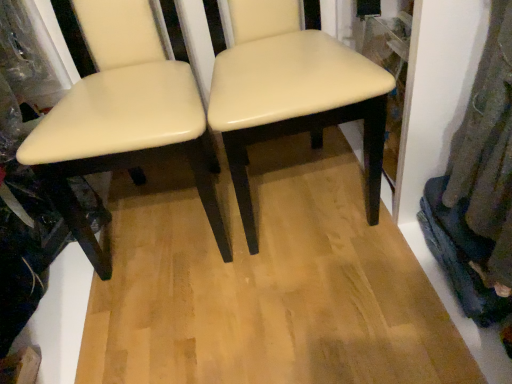
Question: From the image's perspective, is cream matte chair at center, the 1th chair when ordered from right to left, below matte cream chair at center, the 1th chair in the left-to-right sequence?

Choices:
 (A) no
 (B) yes

Answer: (A)

Question: From a real-world perspective, is cream matte chair at center, the 1th chair when ordered from right to left, over matte cream chair at center, placed as the 2th chair when sorted from right to left?

Choices:
 (A) yes
 (B) no

Answer: (B)

Question: Is matte cream chair at center, placed as the 2th chair when sorted from right to left, completely or partially inside cream matte chair at center, the 1th chair when ordered from right to left?

Choices:
 (A) yes
 (B) no

Answer: (B)

Question: Does cream matte chair at center, the second chair when ordered from left to right, have a greater width compared to matte cream chair at center, the 1th chair in the left-to-right sequence?

Choices:
 (A) no
 (B) yes

Answer: (B)

Question: Is cream matte chair at center, the second chair when ordered from left to right, to the left of matte cream chair at center, placed as the 2th chair when sorted from right to left, from the viewer's perspective?

Choices:
 (A) no
 (B) yes

Answer: (A)

Question: Considering the relative positions of cream matte chair at center, the second chair when ordered from left to right, and matte cream chair at center, the 1th chair in the left-to-right sequence, in the image provided, is cream matte chair at center, the second chair when ordered from left to right, in front of matte cream chair at center, the 1th chair in the left-to-right sequence,?

Choices:
 (A) no
 (B) yes

Answer: (A)

Question: Considering the relative sizes of matte cream chair at center, placed as the 2th chair when sorted from right to left, and cream matte chair at center, the 1th chair when ordered from right to left, in the image provided, is matte cream chair at center, placed as the 2th chair when sorted from right to left, wider than cream matte chair at center, the 1th chair when ordered from right to left,?

Choices:
 (A) no
 (B) yes

Answer: (A)

Question: Considering the relative sizes of matte cream chair at center, placed as the 2th chair when sorted from right to left, and cream matte chair at center, the 1th chair when ordered from right to left, in the image provided, is matte cream chair at center, placed as the 2th chair when sorted from right to left, taller than cream matte chair at center, the 1th chair when ordered from right to left,?

Choices:
 (A) yes
 (B) no

Answer: (A)

Question: Is matte cream chair at center, the 1th chair in the left-to-right sequence, oriented away from cream matte chair at center, the second chair when ordered from left to right?

Choices:
 (A) yes
 (B) no

Answer: (B)

Question: Is the position of matte cream chair at center, placed as the 2th chair when sorted from right to left, less distant than that of cream matte chair at center, the second chair when ordered from left to right?

Choices:
 (A) no
 (B) yes

Answer: (B)

Question: Is matte cream chair at center, placed as the 2th chair when sorted from right to left, outside cream matte chair at center, the second chair when ordered from left to right?

Choices:
 (A) no
 (B) yes

Answer: (B)

Question: Considering the relative sizes of matte cream chair at center, the 1th chair in the left-to-right sequence, and cream matte chair at center, the second chair when ordered from left to right, in the image provided, is matte cream chair at center, the 1th chair in the left-to-right sequence, smaller than cream matte chair at center, the second chair when ordered from left to right,?

Choices:
 (A) yes
 (B) no

Answer: (B)

Question: Based on their positions, is cream matte chair at center, the second chair when ordered from left to right, located to the left or right of matte cream chair at center, the 1th chair in the left-to-right sequence?

Choices:
 (A) left
 (B) right

Answer: (B)